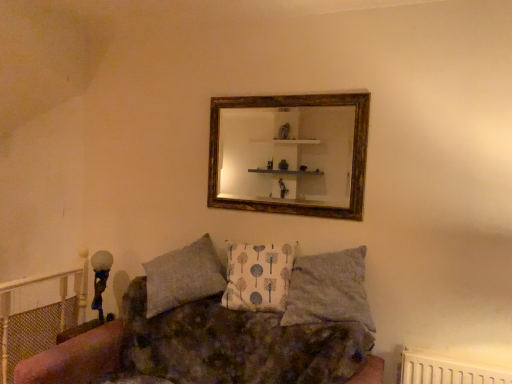
Question: Can you confirm if white fabric pillow at center, positioned as the 1th pillow in left-to-right order, is bigger than textured fabric couch at center?

Choices:
 (A) no
 (B) yes

Answer: (A)

Question: From a real-world perspective, is white fabric pillow at center, positioned as the 1th pillow in left-to-right order, positioned over textured fabric couch at center based on gravity?

Choices:
 (A) no
 (B) yes

Answer: (B)

Question: Is white fabric pillow at center, the second pillow positioned from the right, not close to textured fabric couch at center?

Choices:
 (A) yes
 (B) no

Answer: (B)

Question: Considering the relative sizes of white fabric pillow at center, the second pillow positioned from the right, and textured fabric couch at center in the image provided, is white fabric pillow at center, the second pillow positioned from the right, thinner than textured fabric couch at center?

Choices:
 (A) yes
 (B) no

Answer: (A)

Question: Does white fabric pillow at center, positioned as the 1th pillow in left-to-right order, have a greater height compared to textured fabric couch at center?

Choices:
 (A) yes
 (B) no

Answer: (B)

Question: From the image's perspective, is white fabric pillow at center, positioned as the 1th pillow in left-to-right order, above or below textured fabric couch at center?

Choices:
 (A) below
 (B) above

Answer: (B)

Question: From a real-world perspective, is white fabric pillow at center, the second pillow positioned from the right, above or below textured fabric couch at center?

Choices:
 (A) above
 (B) below

Answer: (A)

Question: In terms of width, does white fabric pillow at center, the second pillow positioned from the right, look wider or thinner when compared to textured fabric couch at center?

Choices:
 (A) wide
 (B) thin

Answer: (B)

Question: Is white fabric pillow at center, positioned as the 1th pillow in left-to-right order, taller or shorter than textured fabric couch at center?

Choices:
 (A) tall
 (B) short

Answer: (B)

Question: Is point (250, 274) closer or farther from the camera than point (257, 139)?

Choices:
 (A) farther
 (B) closer

Answer: (B)

Question: From a real-world perspective, is white fabric pillow at center, the second pillow positioned from the right, positioned above or below gold-framed mirror at upper center?

Choices:
 (A) above
 (B) below

Answer: (B)

Question: Looking at their shapes, would you say white fabric pillow at center, positioned as the 1th pillow in left-to-right order, is wider or thinner than gold-framed mirror at upper center?

Choices:
 (A) thin
 (B) wide

Answer: (B)

Question: Is white fabric pillow at center, the second pillow positioned from the right, taller or shorter than gold-framed mirror at upper center?

Choices:
 (A) tall
 (B) short

Answer: (B)

Question: In terms of height, does white fabric pillow at center, the second pillow positioned from the right, look taller or shorter compared to gray fabric pillow at center, which is the 1th pillow in right-to-left order?

Choices:
 (A) short
 (B) tall

Answer: (B)

Question: From a real-world perspective, is white fabric pillow at center, positioned as the 1th pillow in left-to-right order, physically located above or below gray fabric pillow at center, the second pillow in the left-to-right sequence?

Choices:
 (A) above
 (B) below

Answer: (A)